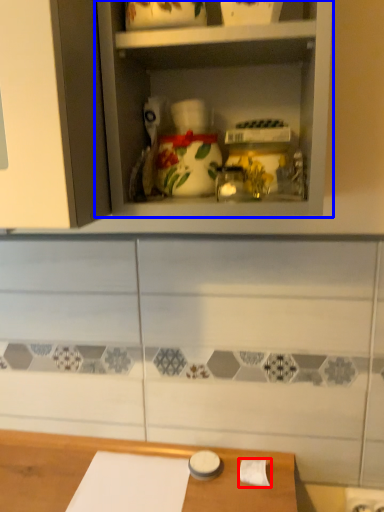
Question: Which object appears farthest to the camera in this image, toilet paper (highlighted by a red box) or shelf (highlighted by a blue box)?

Choices:
 (A) toilet paper
 (B) shelf

Answer: (A)